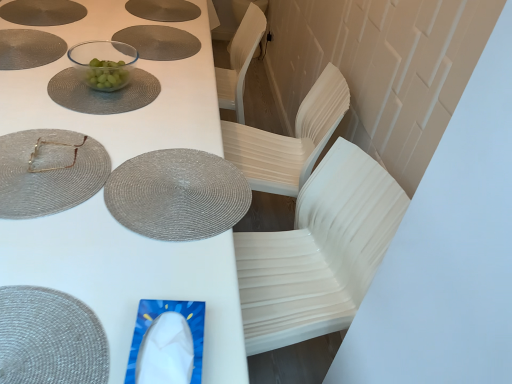
This screenshot has height=384, width=512. I want to click on vacant space behind gold metallic square at upper left, placed as the 3th tableware when sorted from bottom to top, so click(x=81, y=113).